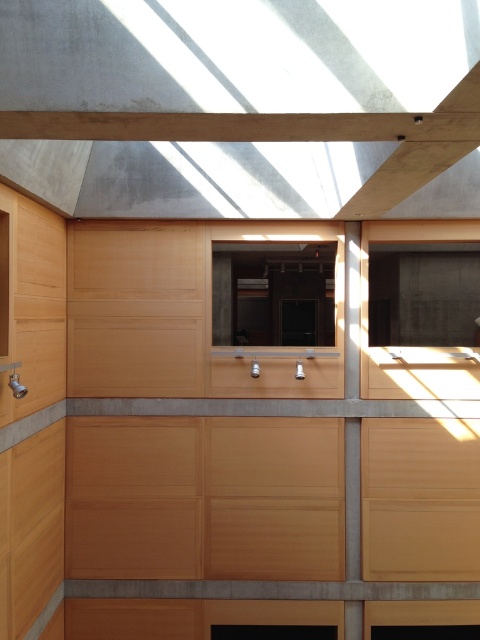
Question: Does transparent glass window at center appear under matte wood window at center?

Choices:
 (A) no
 (B) yes

Answer: (A)

Question: Which object is closer to the camera taking this photo?

Choices:
 (A) matte wood window at center
 (B) transparent glass window at center

Answer: (A)

Question: Is transparent glass window at center wider than matte wood window at center?

Choices:
 (A) no
 (B) yes

Answer: (B)

Question: Is transparent glass window at center smaller than matte wood window at center?

Choices:
 (A) no
 (B) yes

Answer: (A)

Question: Which object is farther from the camera taking this photo?

Choices:
 (A) transparent glass window at center
 (B) matte wood window at center

Answer: (A)